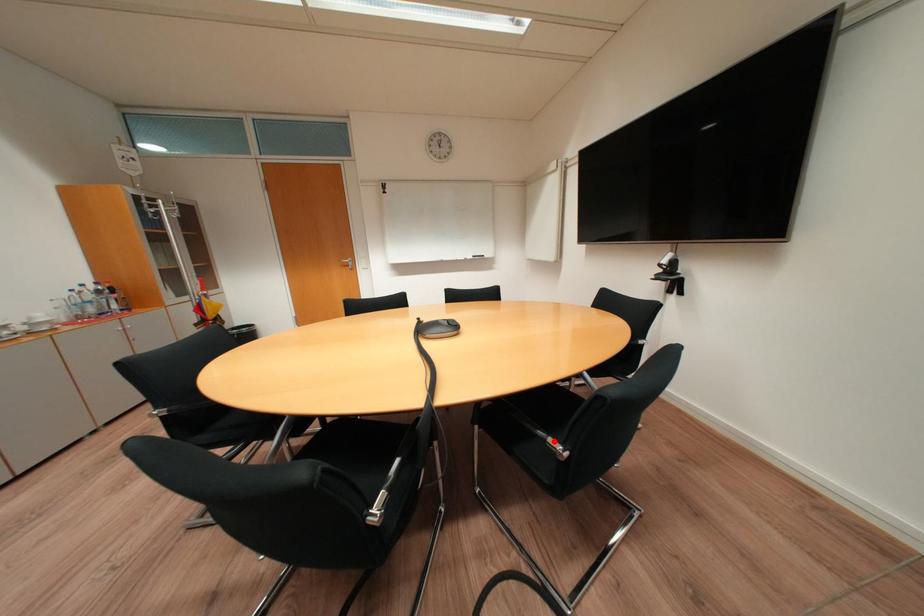
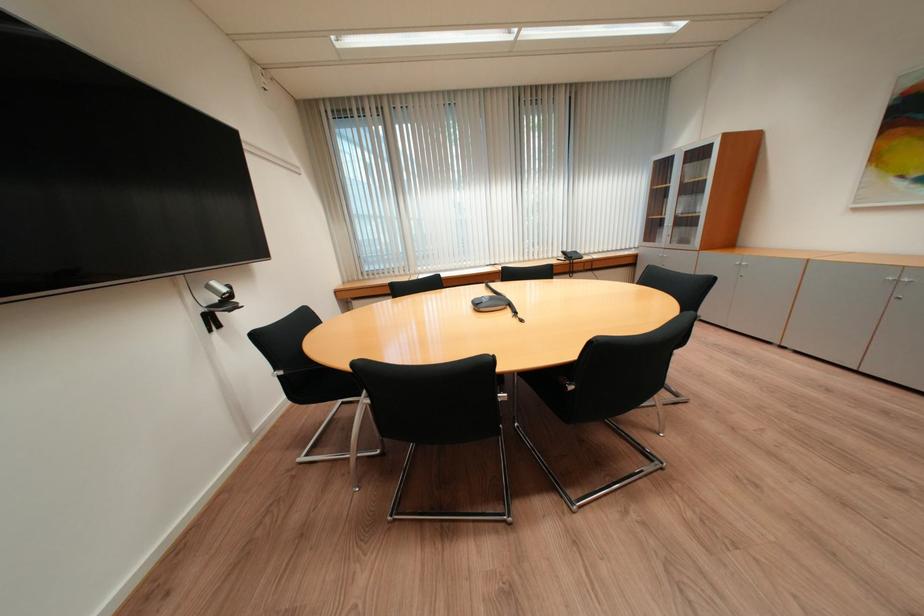
Question: I am providing you with two images of the same scene from different viewpoints. A red point is marked on the first image. Can you still see the location of the red point in image 2?

Choices:
 (A) Yes
 (B) No

Answer: (B)